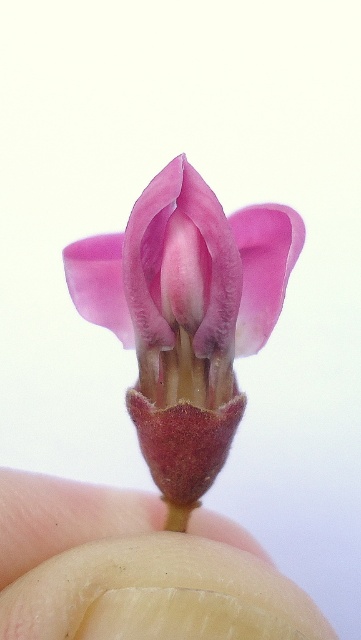
Question: Among these points, which one is nearest to the camera?

Choices:
 (A) (180, 621)
 (B) (206, 342)

Answer: (A)

Question: Is pink matte flower at center thinner than smooth beige finger at center?

Choices:
 (A) yes
 (B) no

Answer: (A)

Question: Is pink matte flower at center thinner than smooth beige finger at center?

Choices:
 (A) yes
 (B) no

Answer: (A)

Question: Is pink matte flower at center wider than smooth beige finger at center?

Choices:
 (A) no
 (B) yes

Answer: (A)

Question: Which point is closer to the camera taking this photo?

Choices:
 (A) (36, 572)
 (B) (80, 269)

Answer: (A)